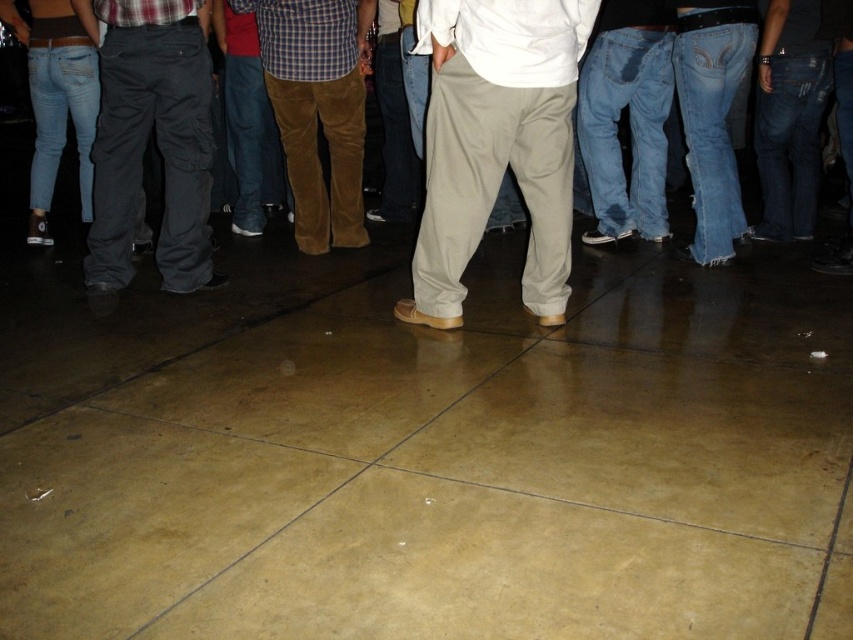
You are standing at the origin of a coordinate system placed at the bottom left corner of the image. You see a point at coordinates point (496, 144). What object is located at that point?

The object located at point (496, 144) is khaki pants at center.

You are at a party and want to approach the person wearing khaki pants at center. If you are standing 2 meters away from them, will you need to move forward or backward to reach them?

The khaki pants at center is 3.01 meters away from the viewer, so you need to move forward by 1.01 meters to reach them.